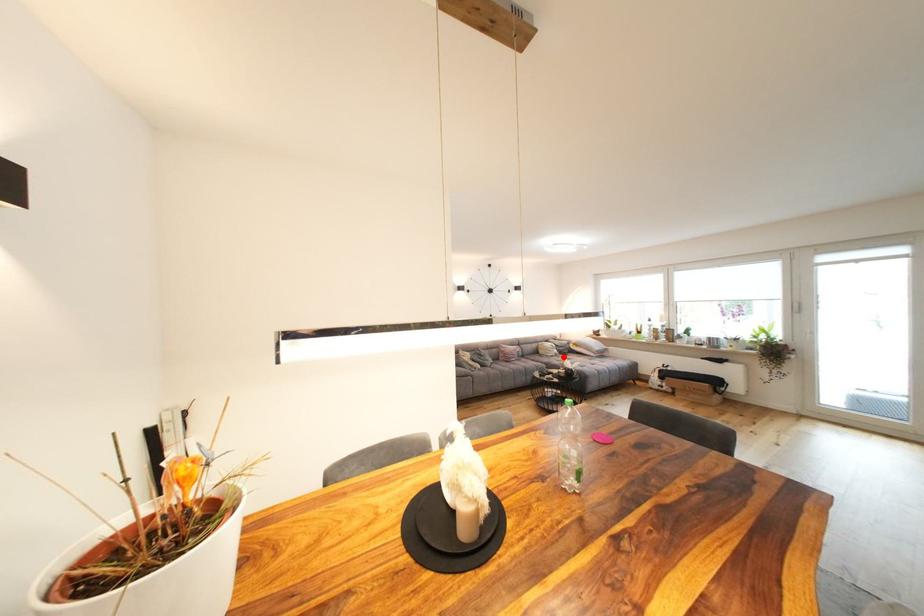
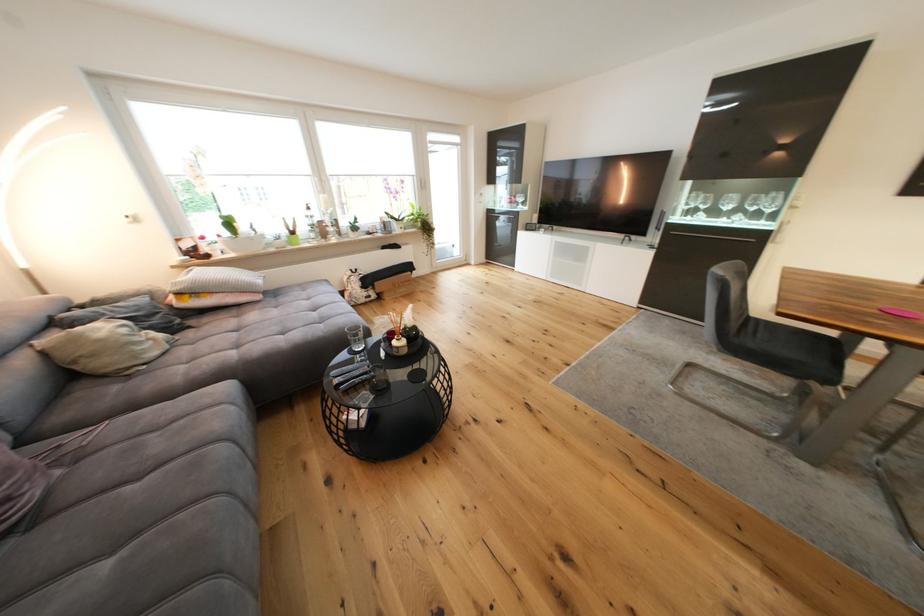
Where in the second image is the point corresponding to the highlighted location from the first image?

(178, 345)